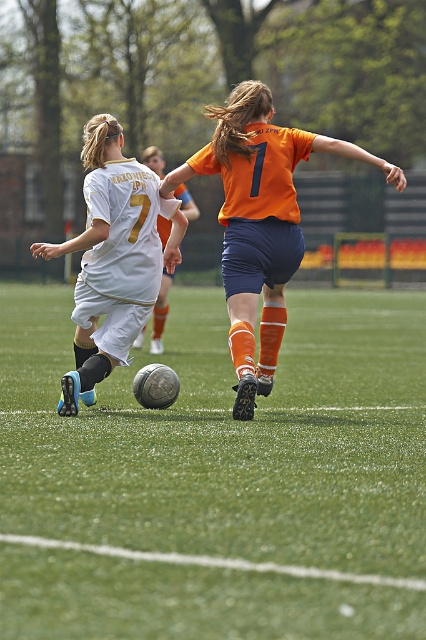
Question: Is green grass football field at center below white matte soccer ball at center?

Choices:
 (A) yes
 (B) no

Answer: (A)

Question: Which point is farther to the camera?

Choices:
 (A) (118, 288)
 (B) (192, 209)
 (C) (163, 500)
 (D) (215, 115)

Answer: (B)

Question: Does orange matte jersey at center come behind white matte jersey at center?

Choices:
 (A) no
 (B) yes

Answer: (A)

Question: Which point is closer to the camera?

Choices:
 (A) (146, 282)
 (B) (253, 262)

Answer: (A)

Question: Is green grass football field at center smaller than orange matte jersey at center?

Choices:
 (A) yes
 (B) no

Answer: (B)

Question: Which point is closer to the camera?

Choices:
 (A) orange matte jersey at center
 (B) white matte jersey at center
 (C) green grass football field at center
 (D) white matte soccer ball at center

Answer: (C)